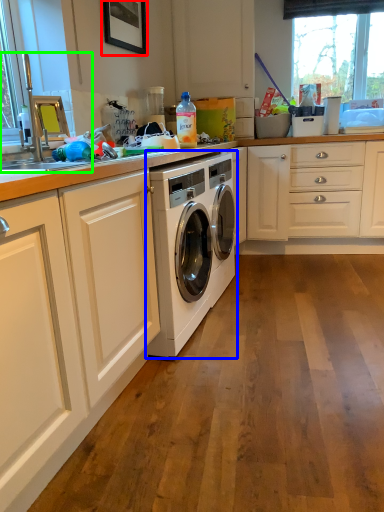
Question: Estimate the real-world distances between objects in this image. Which object is closer to picture frame (highlighted by a red box), washing machine (highlighted by a blue box) or sink (highlighted by a green box)?

Choices:
 (A) washing machine
 (B) sink

Answer: (B)